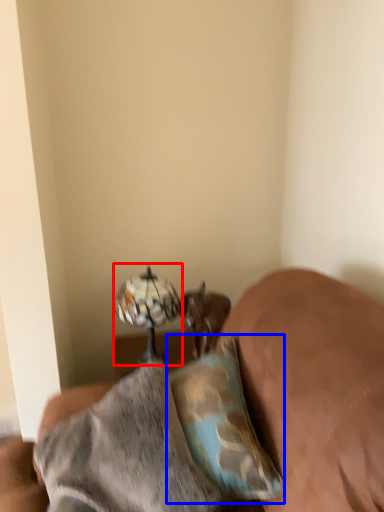
Question: Which object is further to the camera taking this photo, table lamp (highlighted by a red box) or pillow (highlighted by a blue box)?

Choices:
 (A) table lamp
 (B) pillow

Answer: (A)